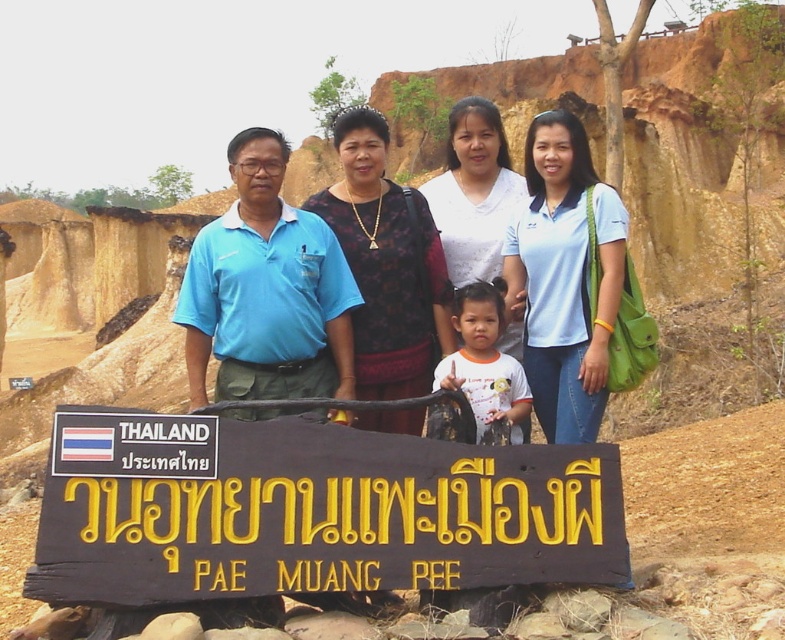
Question: Which object appears farthest from the camera in this image?

Choices:
 (A) black wood sign at lower center
 (B) matte blue shirt at center
 (C) white matte shirt at center

Answer: (C)

Question: Which point is closer to the camera?

Choices:
 (A) matte blue shirt at center
 (B) black wood sign at lower center

Answer: (B)

Question: Can you confirm if black wood sign at lower center is positioned to the right of white matte shirt at center?

Choices:
 (A) no
 (B) yes

Answer: (A)

Question: Which point is farther to the camera?

Choices:
 (A) (236, 490)
 (B) (459, 298)
 (C) (393, 310)

Answer: (C)

Question: Does black wood sign at lower center appear over matte blue shirt at center?

Choices:
 (A) no
 (B) yes

Answer: (A)

Question: Does matte blue shirt at center have a greater width compared to white matte shirt at center?

Choices:
 (A) no
 (B) yes

Answer: (B)